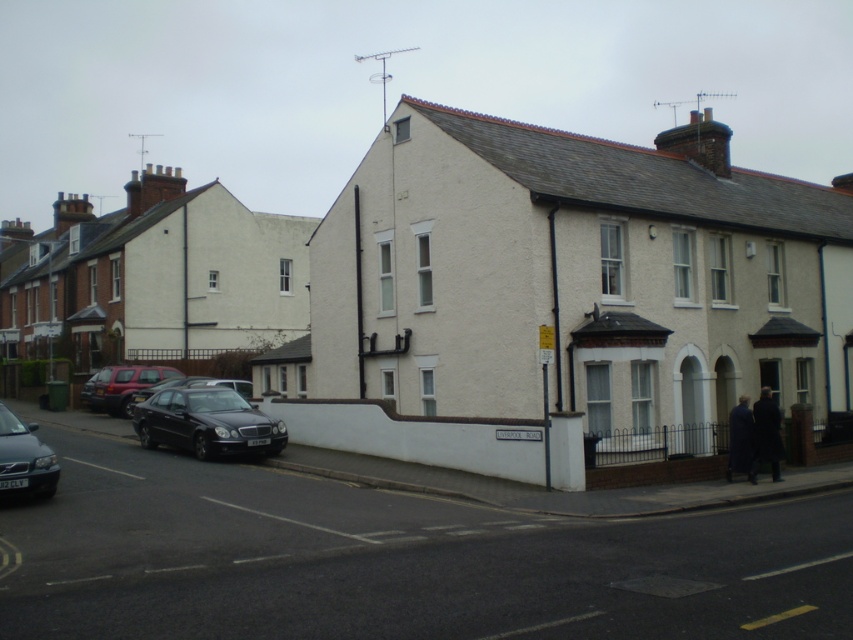
You are a delivery driver trying to park your van, which is 2 meters wide, in this residential area. There are two cars parked on the left side of the road. Can you fit your van between the shiny black sedan at lower left and the matte black car at lower left?

The shiny black sedan at lower left is narrower than the matte black car at lower left. However, the total space between them depends on their combined widths and positioning. Since the question only provides individual width comparisons and not the actual distance between them, it is impossible to determine if the 2 meter wide van can fit without knowing the exact spacing between the two cars.

You are a delivery driver approaching the residential street and see the shiny black sedan at lower left and the matte black car at lower left. Which car is closer to the center of the road?

The shiny black sedan at lower left is closer to the center of the road because it is positioned to the right of the matte black car at lower left, which is further left.